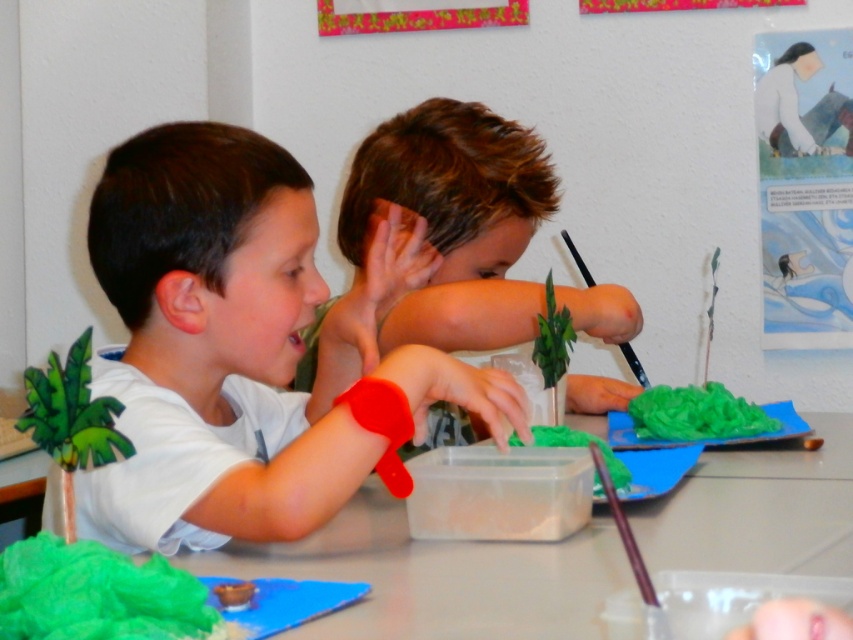
Can you confirm if white matte shirt at center is bigger than brown hair boy at center?

Yes.

Does white matte shirt at center lie behind brown hair boy at center?

That is False.

Is point (132, 358) closer to camera compared to point (581, 381)?

Yes, it is.

The width and height of the screenshot is (853, 640). Identify the location of white matte shirt at center. (248, 348).

Consider the image. Measure the distance from green paper at center to brown hair boy at center.

The distance of green paper at center from brown hair boy at center is 14.59 inches.

Is green paper at center bigger than brown hair boy at center?

Actually, green paper at center might be smaller than brown hair boy at center.

Is point (242, 556) closer to viewer compared to point (409, 333)?

Yes, it is in front of point (409, 333).

Identify the location of green paper at center. (439, 577).

Who is shorter, white matte shirt at center or green paper at center?

green paper at center

Does white matte shirt at center have a lesser height compared to green paper at center?

Incorrect, white matte shirt at center's height does not fall short of green paper at center's.

Locate an element on the screen. This screenshot has height=640, width=853. white matte shirt at center is located at coordinates (248, 348).